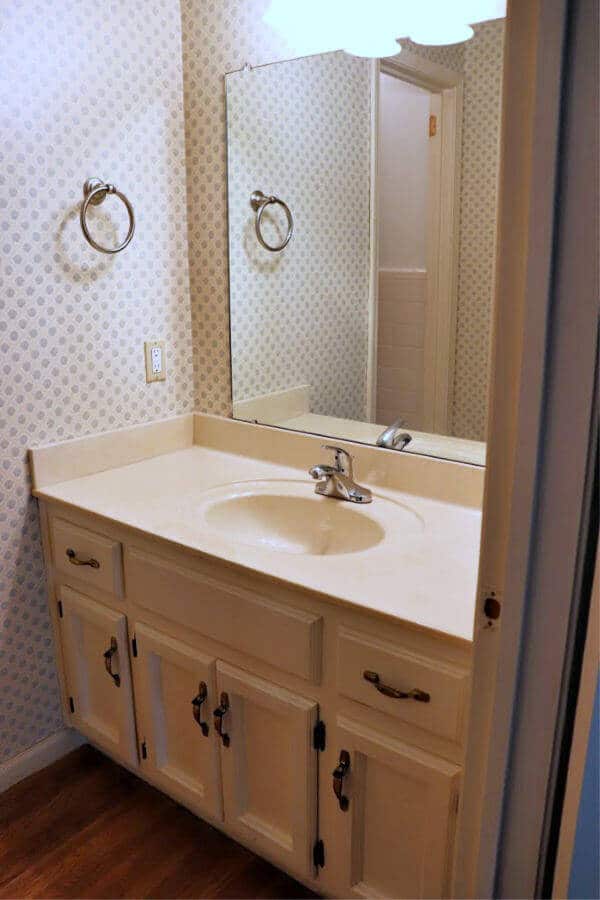
At what (x,y) coordinates should I click in order to perform the action: click on light fixture. Please return your answer as a coordinate pair (x, y). The height and width of the screenshot is (900, 600). Looking at the image, I should click on (388, 22).